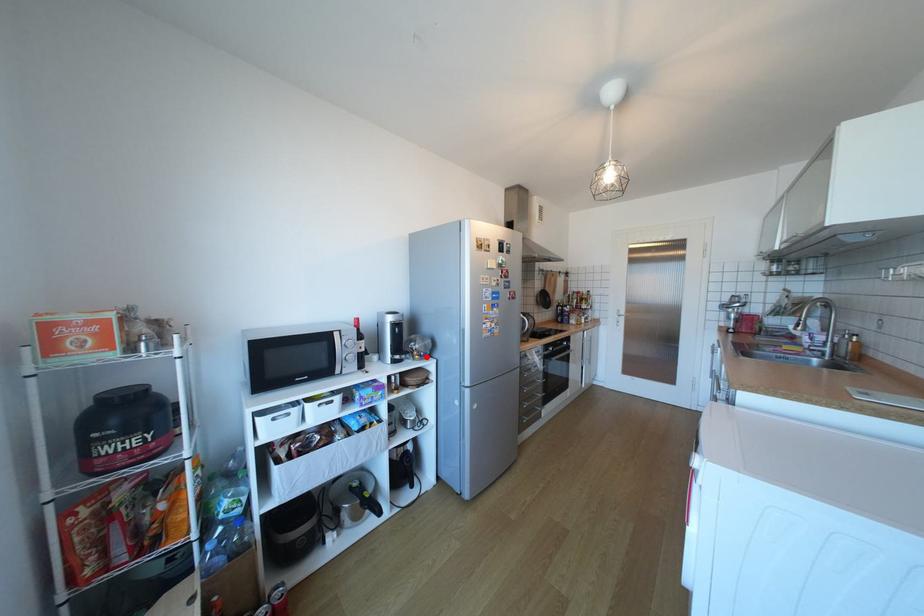
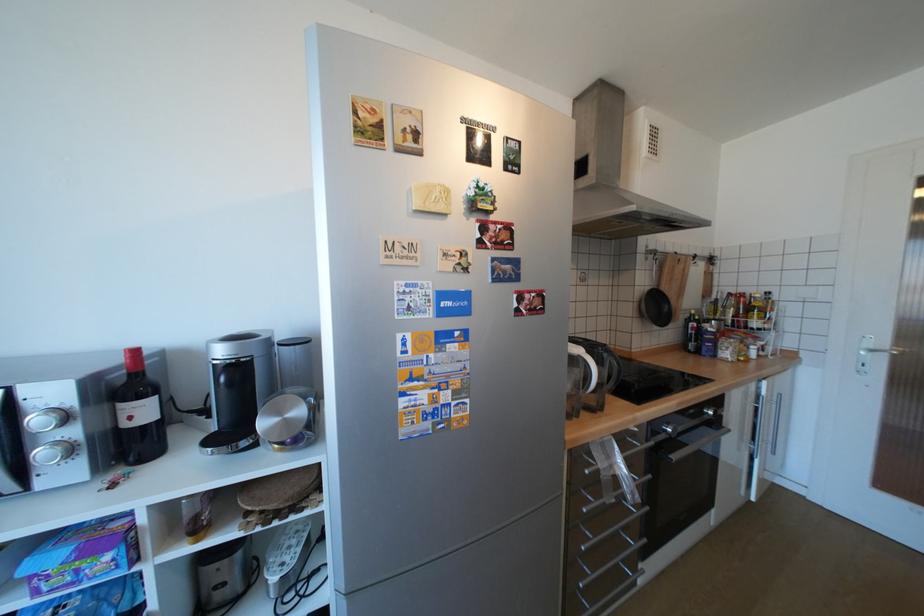
In the second image, find the point that corresponds to the highlighted location in the first image.

(286, 446)